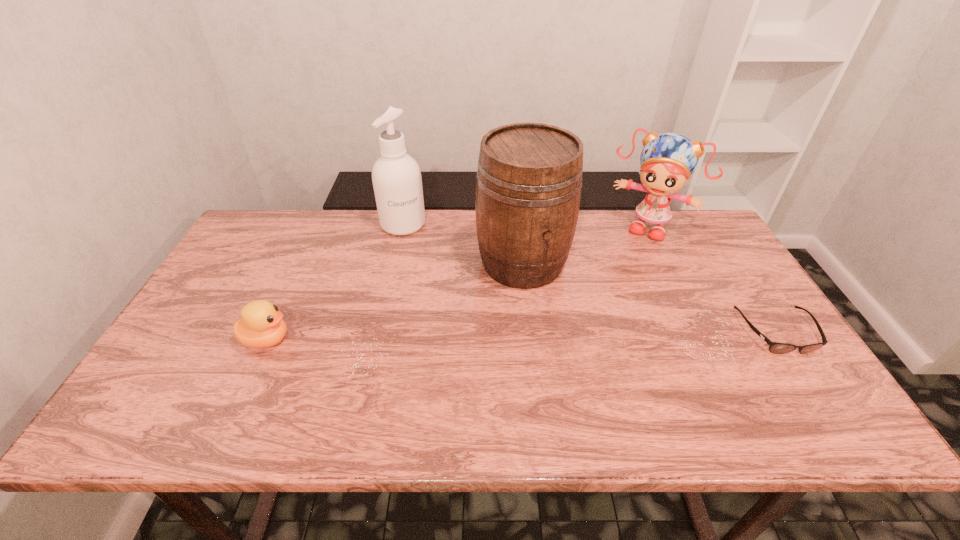
At what (x,y) coordinates should I click in order to perform the action: click on vacant region between the cleansing agent and the sunglasses. Please return your answer as a coordinate pair (x, y). Looking at the image, I should click on (590, 278).

Identify the location of vacant space that's between the leftmost object and the third shortest object. (458, 284).

Image resolution: width=960 pixels, height=540 pixels. Find the location of `vacant region between the second shortest object and the third tallest object`. vacant region between the second shortest object and the third tallest object is located at coordinates (458, 284).

This screenshot has width=960, height=540. What are the coordinates of `vacant area that lies between the third object from right to left and the second shortest object` in the screenshot? It's located at click(x=395, y=301).

Identify the location of free space that is in between the shortest object and the second object from left to right. This screenshot has height=540, width=960. (590, 278).

Locate an element on the screen. This screenshot has height=540, width=960. free space between the shortest object and the cleansing agent is located at coordinates (590, 278).

The width and height of the screenshot is (960, 540). Find the location of `object that can be found as the closest to the doll`. object that can be found as the closest to the doll is located at coordinates (529, 179).

Point out which object is positioned as the second nearest to the second shortest object. Please provide its 2D coordinates. Your answer should be formatted as a tuple, i.e. [(x, y)], where the tuple contains the x and y coordinates of a point satisfying the conditions above.

[(529, 179)]

I want to click on blank area in the image that satisfies the following two spatial constraints: 1. on the back side of the third object from left to right; 2. on the left side of the doll, so click(518, 227).